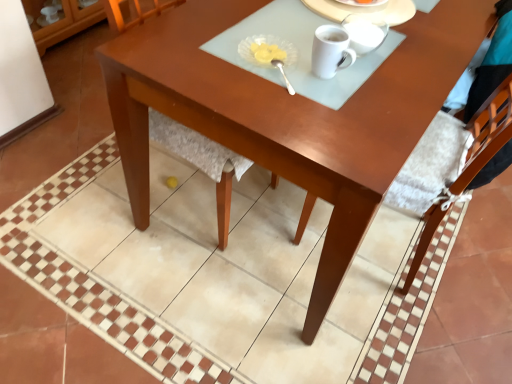
Where is `free space in front of white glossy mug at upper center`? The height and width of the screenshot is (384, 512). free space in front of white glossy mug at upper center is located at coordinates (323, 110).